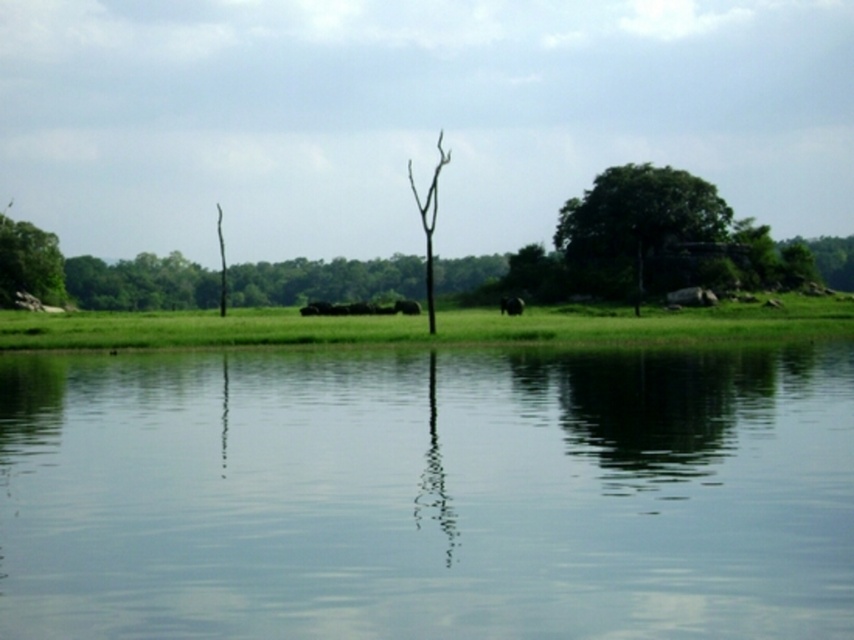
Between brown fuzzy elephant at center and brown furry elephant at center, which one has more height?

With more height is brown fuzzy elephant at center.

Is point (506, 300) in front of point (396, 307)?

Yes, point (506, 300) is in front of point (396, 307).

This screenshot has width=854, height=640. In order to click on brown fuzzy elephant at center in this screenshot , I will do `click(512, 305)`.

The height and width of the screenshot is (640, 854). What are the coordinates of `brown fuzzy elephant at center` in the screenshot? It's located at (512, 305).

Between point (787, 362) and point (408, 301), which one is positioned in front?

Positioned in front is point (787, 362).

Measure the distance between transparent water at center and brown furry elephant at center.

transparent water at center and brown furry elephant at center are 169.58 feet apart from each other.

Who is more distant from viewer, (261, 589) or (410, 304)?

Positioned behind is point (410, 304).

Locate an element on the screen. This screenshot has width=854, height=640. transparent water at center is located at coordinates (428, 493).

Can you confirm if transparent water at center is positioned to the left of green leafy tree at upper right?

Indeed, transparent water at center is positioned on the left side of green leafy tree at upper right.

Is point (238, 502) positioned before point (711, 218)?

Yes, it is.

This screenshot has height=640, width=854. Identify the location of transparent water at center. (428, 493).